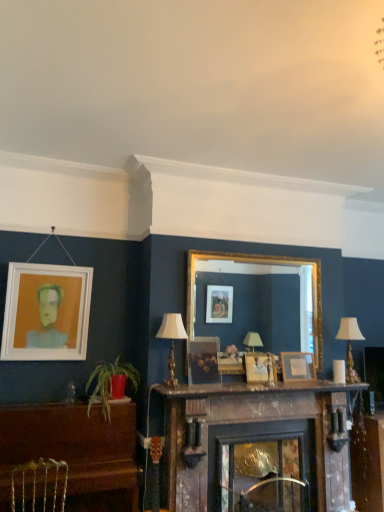
Question: Can you confirm if wooden mantle at center is shorter than white matte picture frame at upper left, which is the fourth picture frame in right-to-left order?

Choices:
 (A) no
 (B) yes

Answer: (B)

Question: Is wooden mantle at center not close to white matte picture frame at upper left, acting as the first picture frame starting from the left?

Choices:
 (A) no
 (B) yes

Answer: (B)

Question: Is wooden mantle at center behind white matte picture frame at upper left, acting as the first picture frame starting from the left?

Choices:
 (A) yes
 (B) no

Answer: (B)

Question: Is wooden mantle at center taller than white matte picture frame at upper left, which is the fourth picture frame in right-to-left order?

Choices:
 (A) no
 (B) yes

Answer: (A)

Question: Is wooden mantle at center surrounding white matte picture frame at upper left, acting as the first picture frame starting from the left?

Choices:
 (A) no
 (B) yes

Answer: (A)

Question: From a real-world perspective, is wooden mantle at center physically above white matte picture frame at upper left, acting as the first picture frame starting from the left?

Choices:
 (A) yes
 (B) no

Answer: (B)

Question: From a real-world perspective, is wooden picture frame at center, which is the third picture frame from left to right, physically above white matte picture frame at upper left, acting as the first picture frame starting from the left?

Choices:
 (A) no
 (B) yes

Answer: (A)

Question: Can we say wooden picture frame at center, arranged as the 2th picture frame when viewed from the right, lies outside white matte picture frame at upper left, acting as the first picture frame starting from the left?

Choices:
 (A) yes
 (B) no

Answer: (A)

Question: Does wooden picture frame at center, arranged as the 2th picture frame when viewed from the right, appear on the left side of white matte picture frame at upper left, which is the fourth picture frame in right-to-left order?

Choices:
 (A) no
 (B) yes

Answer: (A)

Question: Does wooden picture frame at center, which is the third picture frame from left to right, have a lesser width compared to white matte picture frame at upper left, acting as the first picture frame starting from the left?

Choices:
 (A) yes
 (B) no

Answer: (A)

Question: From a real-world perspective, is wooden picture frame at center, which is the third picture frame from left to right, beneath white matte picture frame at upper left, acting as the first picture frame starting from the left?

Choices:
 (A) yes
 (B) no

Answer: (A)

Question: Is wooden picture frame at center, arranged as the 2th picture frame when viewed from the right, touching white matte picture frame at upper left, which is the fourth picture frame in right-to-left order?

Choices:
 (A) no
 (B) yes

Answer: (A)

Question: Considering the relative positions of green leafy plant at lower left and metallic silver swivel chair at lower left in the image provided, is green leafy plant at lower left to the left of metallic silver swivel chair at lower left from the viewer's perspective?

Choices:
 (A) yes
 (B) no

Answer: (B)